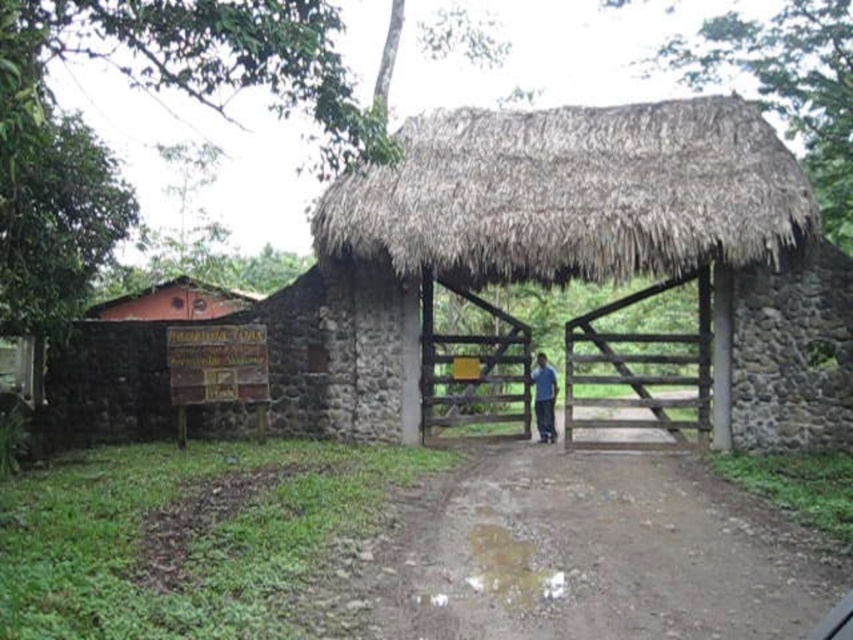
You are a delivery person standing at the entrance of the farm. You need to drive your truck along the brown dirt track at center to deliver packages. However, there is a blue fabric shirt at center hanging from the thatched roof above the gate. Will the shirt block your path?

The brown dirt track at center is positioned under the blue fabric shirt at center, so the shirt is hanging above the track and will not block your path.

You are a delivery person with a cart that is 2 meters wide. You need to navigate through the area between the brown dirt track at center and the thatched straw hut at center. Can your cart fit through the space between them?

The distance between the brown dirt track at center and the thatched straw hut at center is 4.50 meters. Since your cart is 2 meters wide, it can easily fit through the 4.50 meter gap between them.